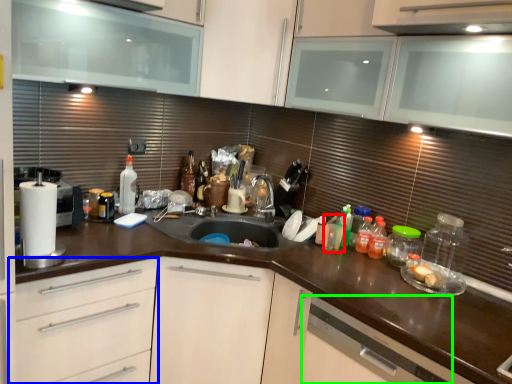
Question: Estimate the real-world distances between objects in this image. Which object is farther from bottle (highlighted by a red box), drawer (highlighted by a blue box) or dish washer (highlighted by a green box)?

Choices:
 (A) drawer
 (B) dish washer

Answer: (A)